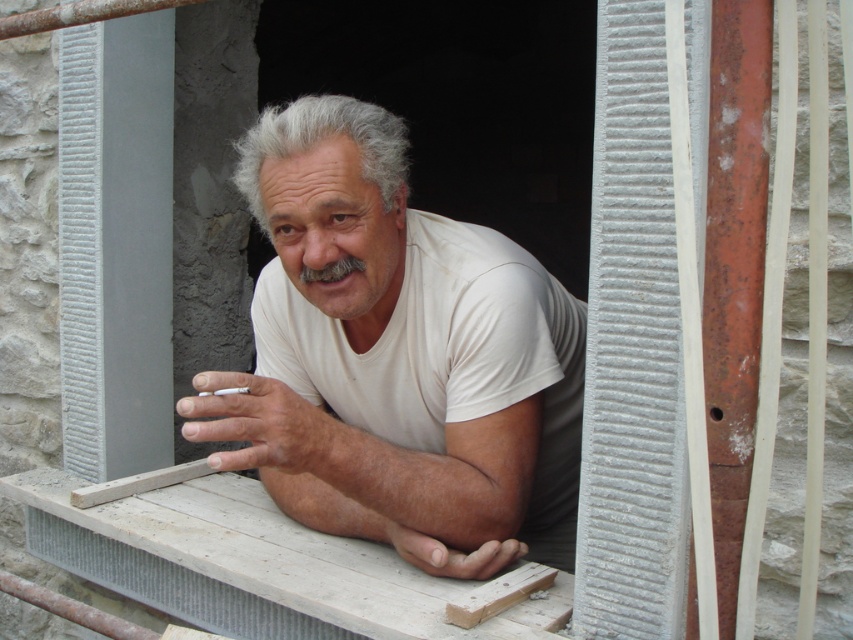
Is white matte t-shirt at center positioned at the back of white cotton t-shirt at center?

That is False.

Is point (280, 497) positioned behind point (457, 314)?

Yes, point (280, 497) is behind point (457, 314).

Locate an element on the screen. Image resolution: width=853 pixels, height=640 pixels. white matte t-shirt at center is located at coordinates (397, 356).